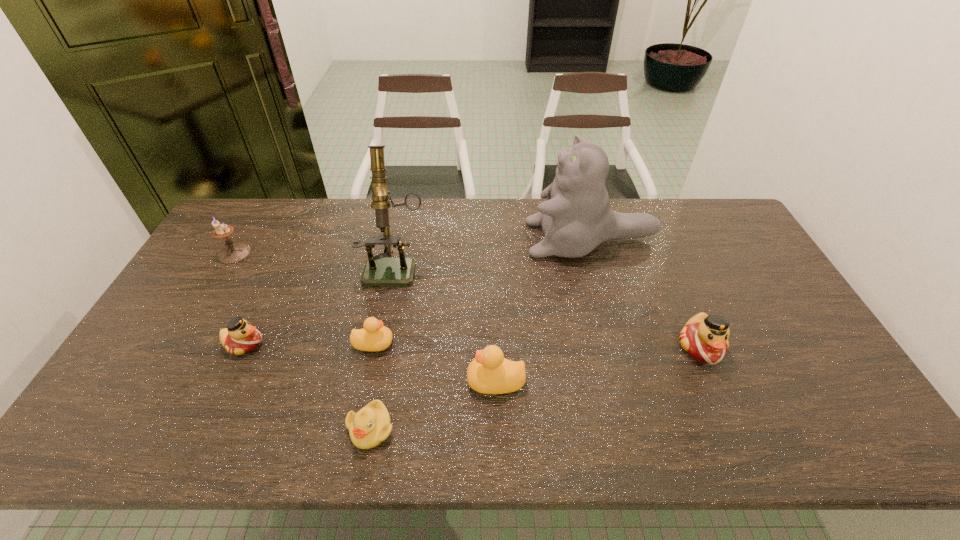
The width and height of the screenshot is (960, 540). In order to click on free point at the left edge in this screenshot , I will do tap(195, 300).

Locate an element on the screen. This screenshot has height=540, width=960. blank area at the far left corner is located at coordinates (253, 206).

Where is `free spot between the green cat and the seventh object from right to left`? free spot between the green cat and the seventh object from right to left is located at coordinates (418, 292).

You are a GUI agent. You are given a task and a screenshot of the screen. Output one action in this format:
    pyautogui.click(x=<x>, y=<y>)
    Task: Click on the vacant area that lies between the yellow duckling and the smaller yellow duck
    
    Given the screenshot: What is the action you would take?
    pyautogui.click(x=372, y=386)

In order to click on free spot between the candle holder and the cat in this screenshot , I will do `click(413, 246)`.

At what (x,y) coordinates should I click in order to perform the action: click on free space between the smaller red duck and the smaller yellow duck. Please return your answer as a coordinate pair (x, y). Looking at the image, I should click on (309, 343).

Identify the location of free spot between the farther yellow duck and the cat. (482, 291).

Where is `unoccupied area between the nearer yellow duck and the smaller red duck`? unoccupied area between the nearer yellow duck and the smaller red duck is located at coordinates (371, 362).

Find the location of a particular element. The image size is (960, 540). free space between the purple candle holder and the smaller red duck is located at coordinates (239, 299).

Where is `unoccupied area between the smaller yellow duck and the leftmost duck`? This screenshot has height=540, width=960. unoccupied area between the smaller yellow duck and the leftmost duck is located at coordinates (309, 343).